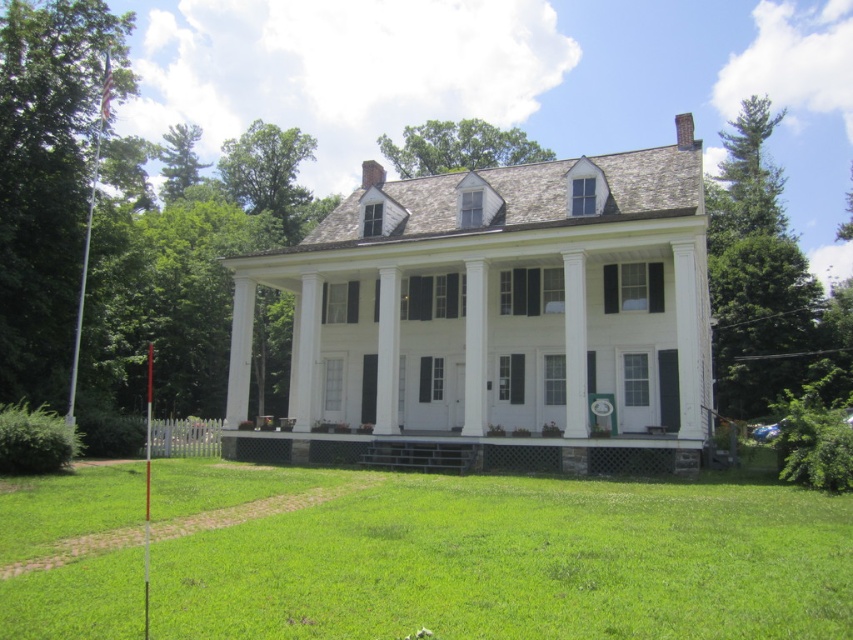
Measure the distance between white painted wood house at center and stone porch at center.

white painted wood house at center is 6.04 meters from stone porch at center.

Is white painted wood house at center positioned at the back of stone porch at center?

Yes, white painted wood house at center is further from the viewer.

Who is more forward, [689,120] or [656,444]?

Positioned in front is point [656,444].

Locate an element on the screen. The image size is (853, 640). white painted wood house at center is located at coordinates (496, 317).

Between white painted wood house at center and green grass at center, which one is positioned higher?

white painted wood house at center is higher up.

In the scene shown: Can you confirm if white painted wood house at center is taller than green grass at center?

Correct, white painted wood house at center is much taller as green grass at center.

Is point (567, 372) less distant than point (59, 602)?

That is False.

Locate an element on the screen. The width and height of the screenshot is (853, 640). white painted wood house at center is located at coordinates (496, 317).

Which is more to the left, green grass at center or stone porch at center?

From the viewer's perspective, stone porch at center appears more on the left side.

Is point (782, 620) in front of point (267, 451)?

That is True.

I want to click on green grass at center, so click(x=500, y=557).